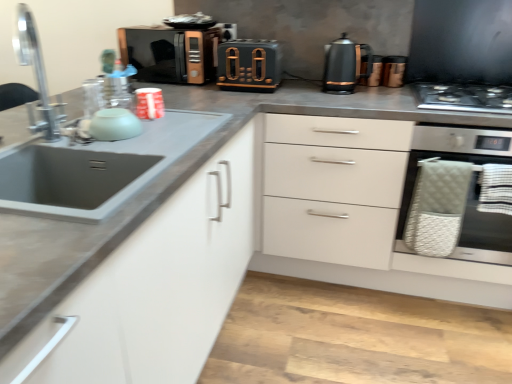
Where is `free space in front of metallic copper kettle at upper right, which is counted as the fifth appliance, starting from the left`? Image resolution: width=512 pixels, height=384 pixels. free space in front of metallic copper kettle at upper right, which is counted as the fifth appliance, starting from the left is located at coordinates point(395,88).